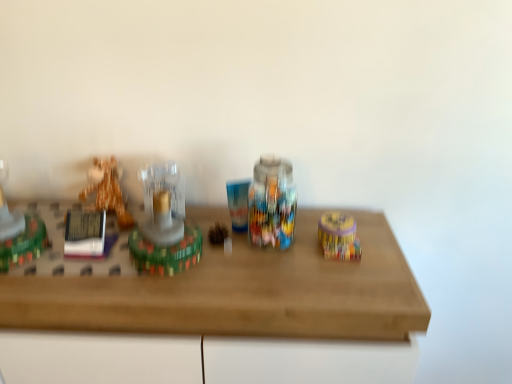
Find the location of `vacant area that is situated to the right of translucent glass candle at center, placed as the third toy when sorted from left to right`. vacant area that is situated to the right of translucent glass candle at center, placed as the third toy when sorted from left to right is located at coordinates (241, 273).